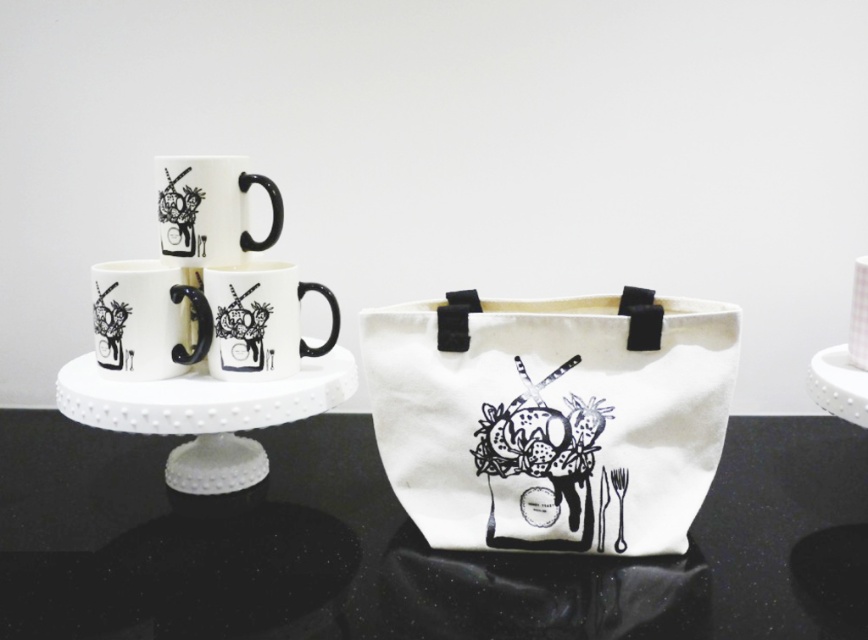
You are organizing a small exhibition and need to decide which item to place on a shelf that can only accommodate items up to 30 cm in width. Given the white canvas tote at center and the white ceramic mugs at center, which item is more likely to fit on the shelf?

The white ceramic mugs at center are less wide than the white canvas tote at center, so the white ceramic mugs at center are more likely to fit on the shelf since their width is under 30 cm.

You are an artist who wants to place a 30 cm wide decorative plate between the white canvas tote at center and the white ceramic mugs at center. Can you fit it in the space between them without overlapping?

The distance between the white canvas tote at center and the white ceramic mugs at center is 25.54 centimeters. Since the plate is 30 cm wide, it is wider than the available space, so it cannot fit without overlapping.

What is the object located at the coordinates point (409,547) in the image?

The object located at point (409,547) is the black glossy table at center.